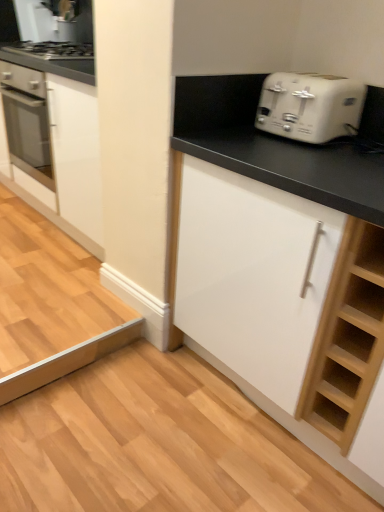
Question: Is white glossy cabinet at left, acting as the 2th cabinetry starting from the right, spatially inside white matte cabinet at center, acting as the second cabinetry starting from the back, or outside of it?

Choices:
 (A) outside
 (B) inside

Answer: (A)

Question: Looking at their shapes, would you say white glossy cabinet at left, which is the first cabinetry from left to right, is wider or thinner than white matte cabinet at center, which ranks as the first cabinetry in front-to-back order?

Choices:
 (A) thin
 (B) wide

Answer: (B)

Question: Estimate the real-world distances between objects in this image. Which object is farther from the white matte cabinet at center, arranged as the 2th cabinetry when viewed from the left?

Choices:
 (A) white plastic toaster at upper right
 (B) white glossy cabinet at left, which is the second cabinetry in front-to-back order

Answer: (B)

Question: Which object is positioned closest to the white matte cabinet at center, acting as the second cabinetry starting from the back?

Choices:
 (A) white glossy cabinet at left, acting as the 2th cabinetry starting from the right
 (B) white plastic toaster at upper right

Answer: (B)